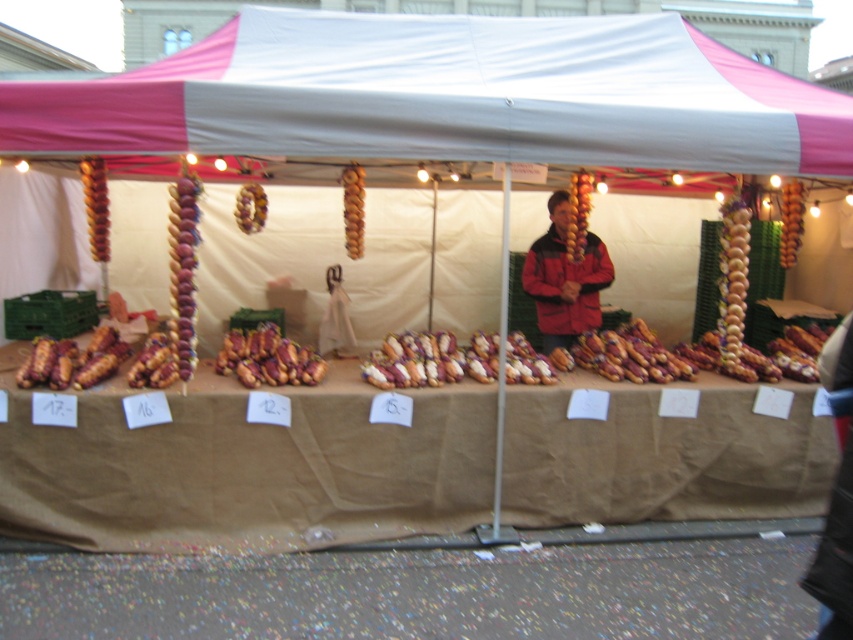
Between point (350, 256) and point (259, 193), which one is positioned in front?

Point (259, 193) is in front.

Can you confirm if brown textured bread at center is bigger than brown glossy hot dog at center?

Yes, brown textured bread at center is bigger than brown glossy hot dog at center.

The width and height of the screenshot is (853, 640). Describe the element at coordinates (352, 209) in the screenshot. I see `brown textured bread at center` at that location.

This screenshot has height=640, width=853. Find the location of `brown textured bread at center`. brown textured bread at center is located at coordinates (352, 209).

Does red matte jacket at center have a lesser height compared to brown matte hot dog at center?

No, red matte jacket at center is not shorter than brown matte hot dog at center.

Can you confirm if red matte jacket at center is wider than brown matte hot dog at center?

Yes, red matte jacket at center is wider than brown matte hot dog at center.

Find the location of a particular element. red matte jacket at center is located at coordinates (564, 278).

Between pink fabric canopy at upper center and golden-brown bread rolls at center, which one has more height?

Standing taller between the two is pink fabric canopy at upper center.

Is pink fabric canopy at upper center taller than golden-brown bread rolls at center?

Indeed, pink fabric canopy at upper center has a greater height compared to golden-brown bread rolls at center.

Who is more distant from viewer, (343, 74) or (410, 380)?

The point (343, 74) is more distant.

Identify the location of pink fabric canopy at upper center. (445, 96).